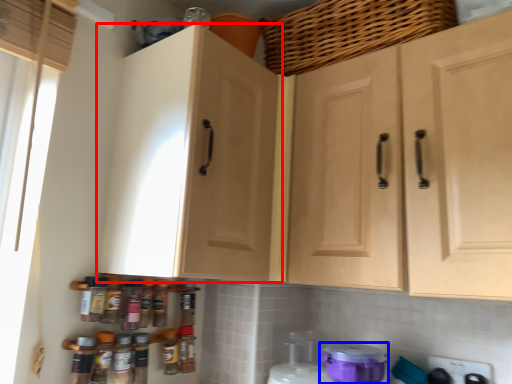
Question: Which object is closer to the camera taking this photo, cabinetry (highlighted by a red box) or appliance (highlighted by a blue box)?

Choices:
 (A) cabinetry
 (B) appliance

Answer: (A)